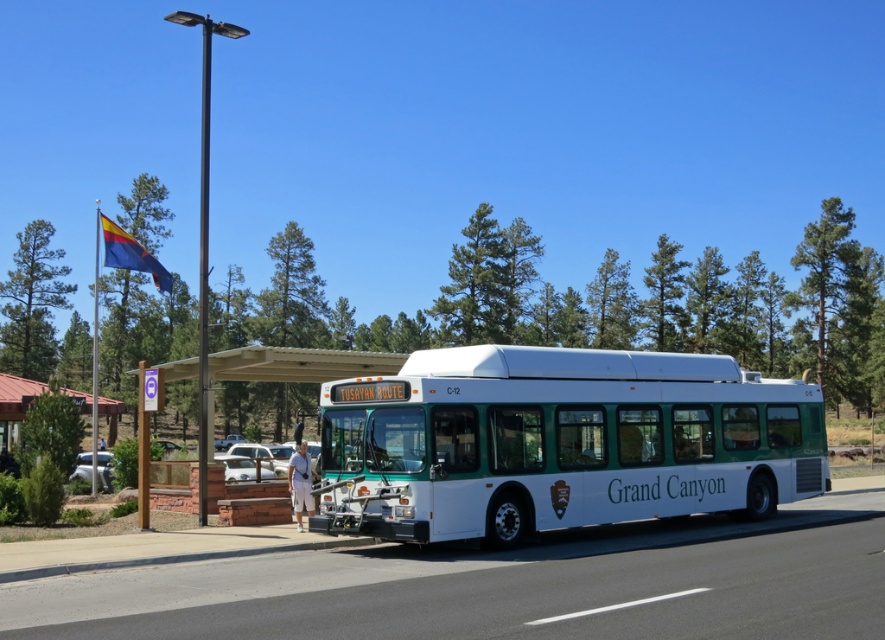
Question: From the image, what is the correct spatial relationship of white/green plastic bus at center in relation to metallic silver car at center?

Choices:
 (A) left
 (B) right

Answer: (B)

Question: Which of these objects is positioned closest to the metallic silver car at center?

Choices:
 (A) wooden bus stop at center
 (B) blue fabric flag at upper left

Answer: (A)

Question: Is wooden bus stop at center below blue fabric flag at upper left?

Choices:
 (A) yes
 (B) no

Answer: (A)

Question: Which of the following is the farthest from the observer?

Choices:
 (A) (118, 240)
 (B) (6, 403)
 (C) (222, 461)

Answer: (B)

Question: Among these points, which one is farthest from the camera?

Choices:
 (A) (29, 387)
 (B) (160, 275)
 (C) (237, 474)
 (D) (805, 454)

Answer: (A)

Question: Is white/green plastic bus at center positioned at the back of metallic silver car at center?

Choices:
 (A) yes
 (B) no

Answer: (B)